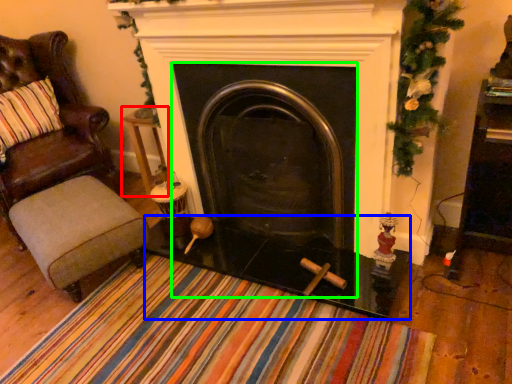
Question: Which object is the closest to the side table (highlighted by a red box)? Choose among these: glass table (highlighted by a blue box) or fireplace (highlighted by a green box).

Choices:
 (A) glass table
 (B) fireplace

Answer: (B)